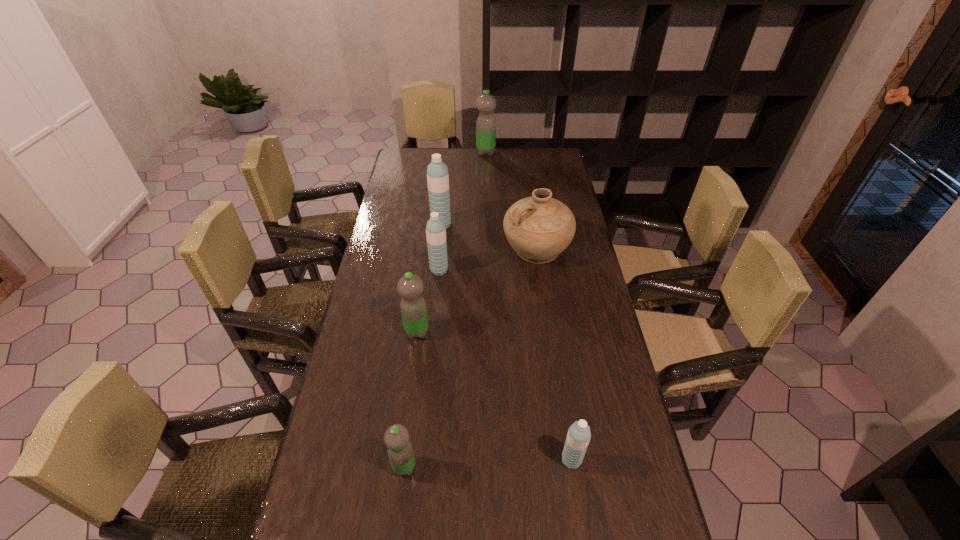
Identify the location of free space between the second farthest water bottle and the pottery. The image size is (960, 540). (489, 237).

Find the location of a particular element. This screenshot has width=960, height=540. free space between the second farthest water bottle and the pottery is located at coordinates (489, 237).

Locate an element on the screen. unoccupied area between the rightmost blue water bottle and the second farthest water bottle is located at coordinates (506, 342).

Find the location of a particular element. The image size is (960, 540). vacant space that is in between the third farthest water bottle and the third nearest water bottle is located at coordinates (428, 301).

Find the location of a particular element. The image size is (960, 540). empty space that is in between the smallest green water bottle and the third nearest water bottle is located at coordinates (411, 399).

At what (x,y) coordinates should I click in order to perform the action: click on empty space that is in between the second farthest water bottle and the second smallest green water bottle. Please return your answer as a coordinate pair (x, y). The height and width of the screenshot is (540, 960). Looking at the image, I should click on (429, 278).

Identify the location of object that can be found as the fourth closest to the nearest green water bottle. The height and width of the screenshot is (540, 960). (539, 228).

At what (x,y) coordinates should I click in order to perform the action: click on object that is the closest to the third farthest water bottle. Please return your answer as a coordinate pair (x, y). The height and width of the screenshot is (540, 960). Looking at the image, I should click on (437, 172).

This screenshot has height=540, width=960. I want to click on water bottle that is the fourth closest to the second nearest blue water bottle, so [578, 437].

Point out which water bottle is positioned as the fourth nearest to the pottery. Please provide its 2D coordinates. Your answer should be formatted as a tuple, i.e. [(x, y)], where the tuple contains the x and y coordinates of a point satisfying the conditions above.

[(486, 103)]